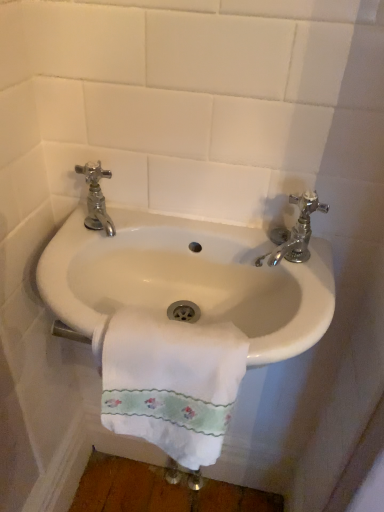
Locate an element on the screen. chrome/metallic faucet at upper left, the 2th tap when ordered from right to left is located at coordinates (96, 198).

Locate an element on the screen. white glossy sink at center is located at coordinates (186, 276).

Does chrome/metallic faucet at right, marked as the 1th tap in a right-to-left arrangement, have a greater width compared to chrome/metallic faucet at upper left, arranged as the 1th tap when viewed from the left?

In fact, chrome/metallic faucet at right, marked as the 1th tap in a right-to-left arrangement, might be narrower than chrome/metallic faucet at upper left, arranged as the 1th tap when viewed from the left.

Between chrome/metallic faucet at right, marked as the 1th tap in a right-to-left arrangement, and chrome/metallic faucet at upper left, the 2th tap when ordered from right to left, which one has more height?

chrome/metallic faucet at upper left, the 2th tap when ordered from right to left, is taller.

Is chrome/metallic faucet at right, the 2th tap positioned from the left, positioned beyond the bounds of chrome/metallic faucet at upper left, arranged as the 1th tap when viewed from the left?

That's correct, chrome/metallic faucet at right, the 2th tap positioned from the left, is outside of chrome/metallic faucet at upper left, arranged as the 1th tap when viewed from the left.

Identify the location of tap below the chrome/metallic faucet at upper left, arranged as the 1th tap when viewed from the left (from a real-world perspective). (294, 232).

Does white glossy sink at center have a lesser height compared to chrome/metallic faucet at upper left, arranged as the 1th tap when viewed from the left?

Correct, white glossy sink at center is not as tall as chrome/metallic faucet at upper left, arranged as the 1th tap when viewed from the left.

Is white glossy sink at center positioned far away from chrome/metallic faucet at upper left, the 2th tap when ordered from right to left?

They are positioned close to each other.

From a real-world perspective, which is physically below, white glossy sink at center or chrome/metallic faucet at upper left, arranged as the 1th tap when viewed from the left?

white glossy sink at center.

Is white glossy sink at center oriented away from chrome/metallic faucet at upper left, arranged as the 1th tap when viewed from the left?

white glossy sink at center is not turned away from chrome/metallic faucet at upper left, arranged as the 1th tap when viewed from the left.

Who is smaller, chrome/metallic faucet at upper left, arranged as the 1th tap when viewed from the left, or white glossy sink at center?

chrome/metallic faucet at upper left, arranged as the 1th tap when viewed from the left.

This screenshot has height=512, width=384. In the image, there is a chrome/metallic faucet at upper left, the 2th tap when ordered from right to left. In order to click on sink below it (from the image's perspective) in this screenshot , I will do `click(186, 276)`.

Does chrome/metallic faucet at upper left, arranged as the 1th tap when viewed from the left, turn towards white glossy sink at center?

No, chrome/metallic faucet at upper left, arranged as the 1th tap when viewed from the left, is not turned towards white glossy sink at center.

Can you confirm if chrome/metallic faucet at upper left, the 2th tap when ordered from right to left, is wider than white glossy sink at center?

No, chrome/metallic faucet at upper left, the 2th tap when ordered from right to left, is not wider than white glossy sink at center.

Which object is closer to the camera taking this photo, white glossy sink at center or white cotton towel at center?

white cotton towel at center is in front.

Does white glossy sink at center touch white cotton towel at center?

No, white glossy sink at center is not in contact with white cotton towel at center.

Can you confirm if white glossy sink at center is shorter than white cotton towel at center?

Indeed, white glossy sink at center has a lesser height compared to white cotton towel at center.

Is white glossy sink at center positioned beyond the bounds of white cotton towel at center?

Yes, white glossy sink at center is not within white cotton towel at center.

Between white glossy sink at center and chrome/metallic faucet at right, marked as the 1th tap in a right-to-left arrangement, which one has less height?

chrome/metallic faucet at right, marked as the 1th tap in a right-to-left arrangement.

Would you consider white glossy sink at center to be distant from chrome/metallic faucet at right, the 2th tap positioned from the left?

That's not correct — white glossy sink at center is a little close to chrome/metallic faucet at right, the 2th tap positioned from the left.

Where is `sink below the chrome/metallic faucet at right, marked as the 1th tap in a right-to-left arrangement (from a real-world perspective)`? sink below the chrome/metallic faucet at right, marked as the 1th tap in a right-to-left arrangement (from a real-world perspective) is located at coordinates (186, 276).

Based on the photo, from the image's perspective, between white glossy sink at center and chrome/metallic faucet at right, the 2th tap positioned from the left, who is located below?

white glossy sink at center, from the image's perspective.

From the image's perspective, is chrome/metallic faucet at right, the 2th tap positioned from the left, on white glossy sink at center?

Yes, from the image's perspective, chrome/metallic faucet at right, the 2th tap positioned from the left, is above white glossy sink at center.

Locate an element on the screen. The image size is (384, 512). tap that is the 1st one when counting backward from the white glossy sink at center is located at coordinates (294, 232).

Is white glossy sink at center located within chrome/metallic faucet at right, marked as the 1th tap in a right-to-left arrangement?

That's incorrect, white glossy sink at center is not inside chrome/metallic faucet at right, marked as the 1th tap in a right-to-left arrangement.

Is chrome/metallic faucet at right, the 2th tap positioned from the left, in front of white glossy sink at center?

No, chrome/metallic faucet at right, the 2th tap positioned from the left, is behind white glossy sink at center.

Where is `tap on the left of chrome/metallic faucet at right, marked as the 1th tap in a right-to-left arrangement`? tap on the left of chrome/metallic faucet at right, marked as the 1th tap in a right-to-left arrangement is located at coordinates (96, 198).

Considering the relative sizes of chrome/metallic faucet at upper left, arranged as the 1th tap when viewed from the left, and chrome/metallic faucet at right, marked as the 1th tap in a right-to-left arrangement, in the image provided, is chrome/metallic faucet at upper left, arranged as the 1th tap when viewed from the left, taller than chrome/metallic faucet at right, marked as the 1th tap in a right-to-left arrangement,?

Yes, chrome/metallic faucet at upper left, arranged as the 1th tap when viewed from the left, is taller than chrome/metallic faucet at right, marked as the 1th tap in a right-to-left arrangement.

Is chrome/metallic faucet at upper left, arranged as the 1th tap when viewed from the left, bigger or smaller than chrome/metallic faucet at right, marked as the 1th tap in a right-to-left arrangement?

chrome/metallic faucet at upper left, arranged as the 1th tap when viewed from the left, is bigger than chrome/metallic faucet at right, marked as the 1th tap in a right-to-left arrangement.

Who is more distant, chrome/metallic faucet at upper left, arranged as the 1th tap when viewed from the left, or chrome/metallic faucet at right, the 2th tap positioned from the left?

chrome/metallic faucet at upper left, arranged as the 1th tap when viewed from the left, is more distant.

Identify the location of tap located behind the chrome/metallic faucet at right, the 2th tap positioned from the left. (96, 198).

Find the location of `tap to the left of white glossy sink at center`. tap to the left of white glossy sink at center is located at coordinates (96, 198).

Which object lies further to the anchor point chrome/metallic faucet at upper left, arranged as the 1th tap when viewed from the left, chrome/metallic faucet at right, the 2th tap positioned from the left, or white glossy sink at center?

The object further to chrome/metallic faucet at upper left, arranged as the 1th tap when viewed from the left, is chrome/metallic faucet at right, the 2th tap positioned from the left.

Looking at the image, which one is located further to white cotton towel at center, chrome/metallic faucet at right, marked as the 1th tap in a right-to-left arrangement, or chrome/metallic faucet at upper left, arranged as the 1th tap when viewed from the left?

chrome/metallic faucet at upper left, arranged as the 1th tap when viewed from the left, is further to white cotton towel at center.

From the image, which object appears to be nearer to chrome/metallic faucet at upper left, arranged as the 1th tap when viewed from the left, white cotton towel at center or chrome/metallic faucet at right, the 2th tap positioned from the left?

white cotton towel at center lies closer to chrome/metallic faucet at upper left, arranged as the 1th tap when viewed from the left, than the other object.

From the image, which object appears to be farther from chrome/metallic faucet at upper left, the 2th tap when ordered from right to left, chrome/metallic faucet at right, marked as the 1th tap in a right-to-left arrangement, or white cotton towel at center?

Based on the image, chrome/metallic faucet at right, marked as the 1th tap in a right-to-left arrangement, appears to be further to chrome/metallic faucet at upper left, the 2th tap when ordered from right to left.

Looking at the image, which one is located further to white glossy sink at center, white cotton towel at center or chrome/metallic faucet at right, the 2th tap positioned from the left?

chrome/metallic faucet at right, the 2th tap positioned from the left, is further to white glossy sink at center.

From the image, which object appears to be nearer to chrome/metallic faucet at right, the 2th tap positioned from the left, white glossy sink at center or chrome/metallic faucet at upper left, the 2th tap when ordered from right to left?

white glossy sink at center is positioned closer to the anchor chrome/metallic faucet at right, the 2th tap positioned from the left.

Based on their spatial positions, is chrome/metallic faucet at upper left, the 2th tap when ordered from right to left, or white glossy sink at center further from chrome/metallic faucet at right, the 2th tap positioned from the left?

Based on the image, chrome/metallic faucet at upper left, the 2th tap when ordered from right to left, appears to be further to chrome/metallic faucet at right, the 2th tap positioned from the left.

Estimate the real-world distances between objects in this image. Which object is closer to white glossy sink at center, chrome/metallic faucet at upper left, the 2th tap when ordered from right to left, or white cotton towel at center?

Among the two, white cotton towel at center is located nearer to white glossy sink at center.

Identify the location of sink between chrome/metallic faucet at upper left, arranged as the 1th tap when viewed from the left, and chrome/metallic faucet at right, the 2th tap positioned from the left, from left to right. (186, 276).

This screenshot has width=384, height=512. Find the location of `sink located between white cotton towel at center and chrome/metallic faucet at right, the 2th tap positioned from the left, in the left-right direction`. sink located between white cotton towel at center and chrome/metallic faucet at right, the 2th tap positioned from the left, in the left-right direction is located at coordinates (186, 276).

Where is `towel/napkin between chrome/metallic faucet at upper left, arranged as the 1th tap when viewed from the left, and chrome/metallic faucet at right, marked as the 1th tap in a right-to-left arrangement, in the horizontal direction`? towel/napkin between chrome/metallic faucet at upper left, arranged as the 1th tap when viewed from the left, and chrome/metallic faucet at right, marked as the 1th tap in a right-to-left arrangement, in the horizontal direction is located at coordinates (172, 383).

Where is `sink between chrome/metallic faucet at upper left, the 2th tap when ordered from right to left, and white cotton towel at center vertically`? sink between chrome/metallic faucet at upper left, the 2th tap when ordered from right to left, and white cotton towel at center vertically is located at coordinates (186, 276).